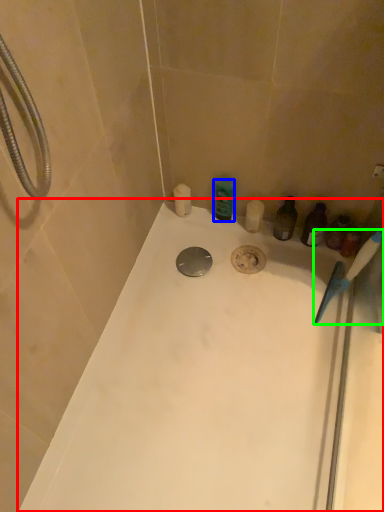
Question: Based on their relative distances, which object is farther from bathtub (highlighted by a red box)? Choose from toiletry (highlighted by a blue box) and toothbrush (highlighted by a green box).

Choices:
 (A) toiletry
 (B) toothbrush

Answer: (A)